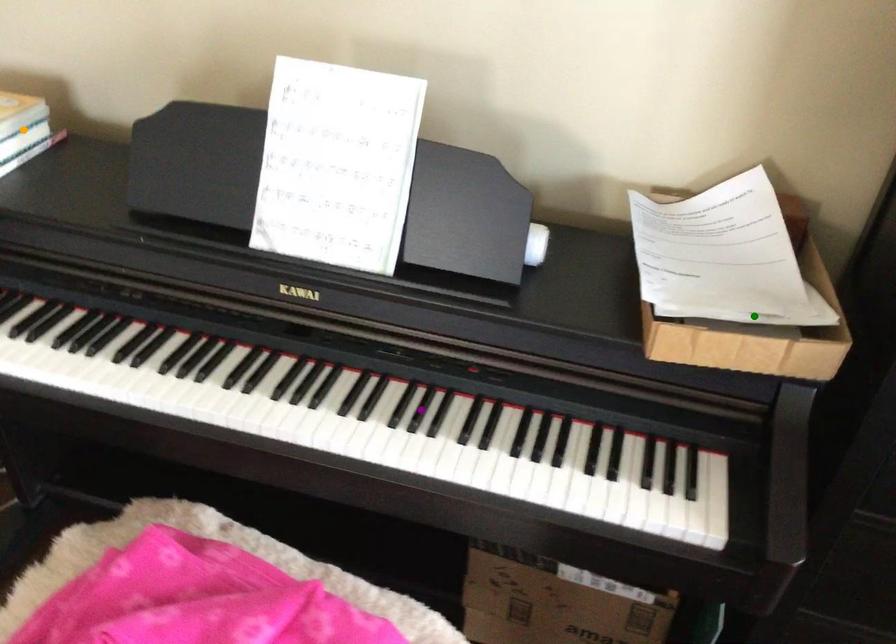
Order these from nearest to farthest:
- purple point
- green point
- orange point

green point → purple point → orange point